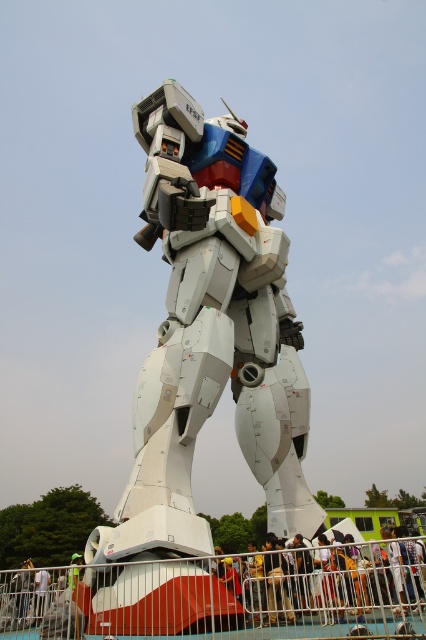
Who is more distant from viewer, (284,337) or (333,532)?

The point (284,337) is more distant.

Find the location of a particular element. The image size is (426, 640). white metallic robot at center is located at coordinates (210, 333).

Between white metallic robot at center and metal/rusty rail at lower center, which one has less height?

metal/rusty rail at lower center is shorter.

Identify the location of white metallic robot at center. coord(210,333).

Can you confirm if metal/rusty rail at lower center is thinner than yellow fabric person at center?

No, metal/rusty rail at lower center is not thinner than yellow fabric person at center.

Does point (213, 566) come closer to viewer compared to point (380, 588)?

That is False.

Measure the distance between point (x=34, y=628) and camera.

Point (x=34, y=628) is 138.69 feet from camera.

Where is `metal/rusty rail at lower center`? metal/rusty rail at lower center is located at coordinates (224, 596).